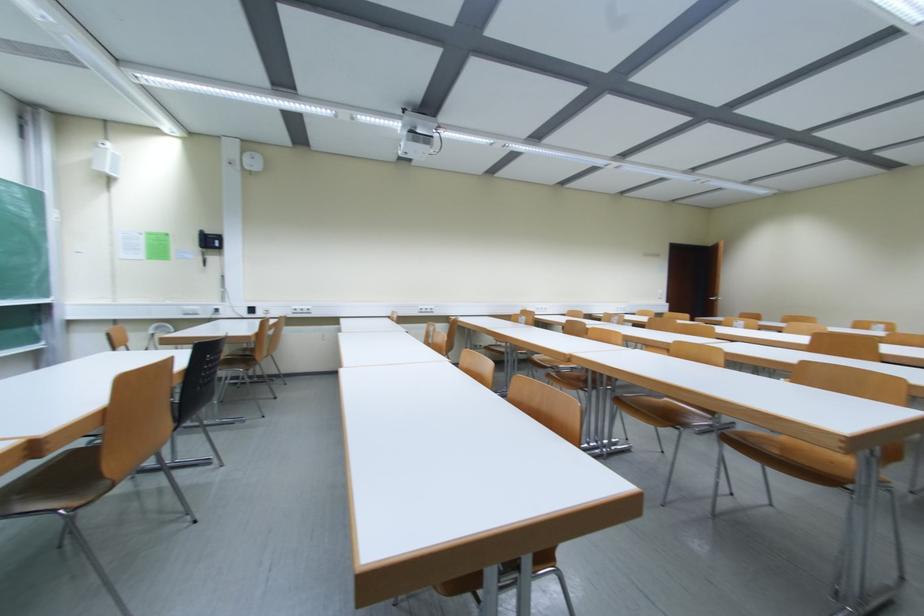
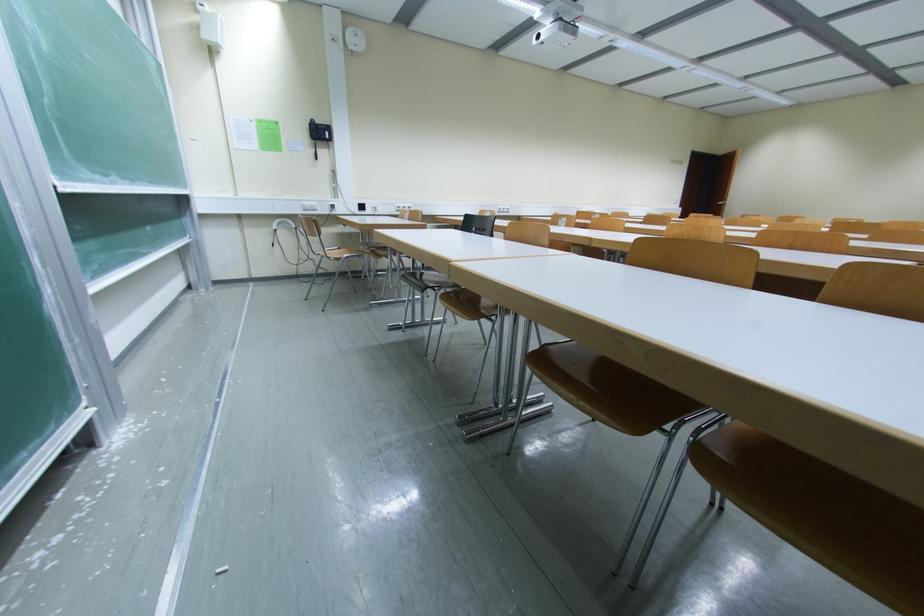
Question: Which direction would the cameraman need to move to produce the second image? Reply with the corresponding letter.

Choices:
 (A) Left
 (B) Right
 (C) Forward
 (D) Backward

Answer: (A)